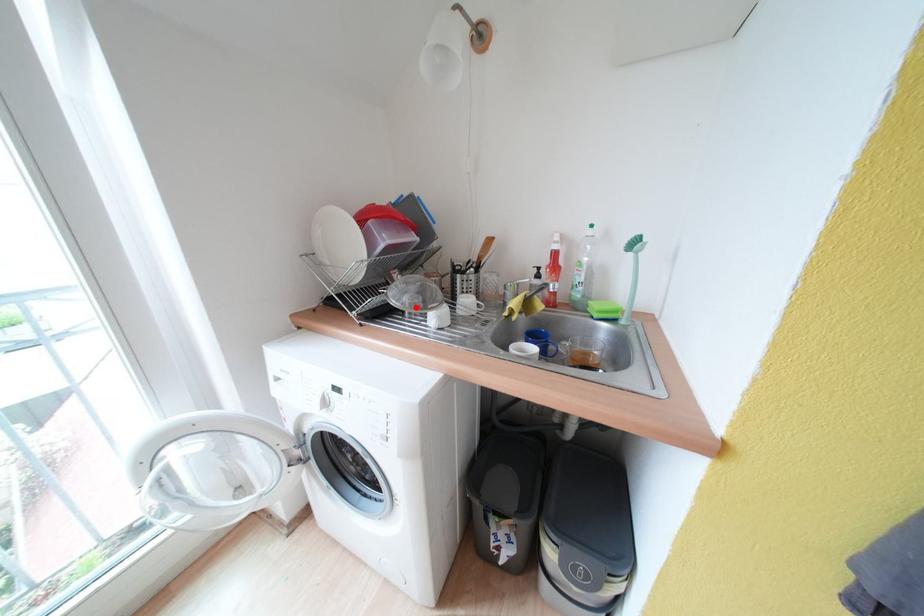
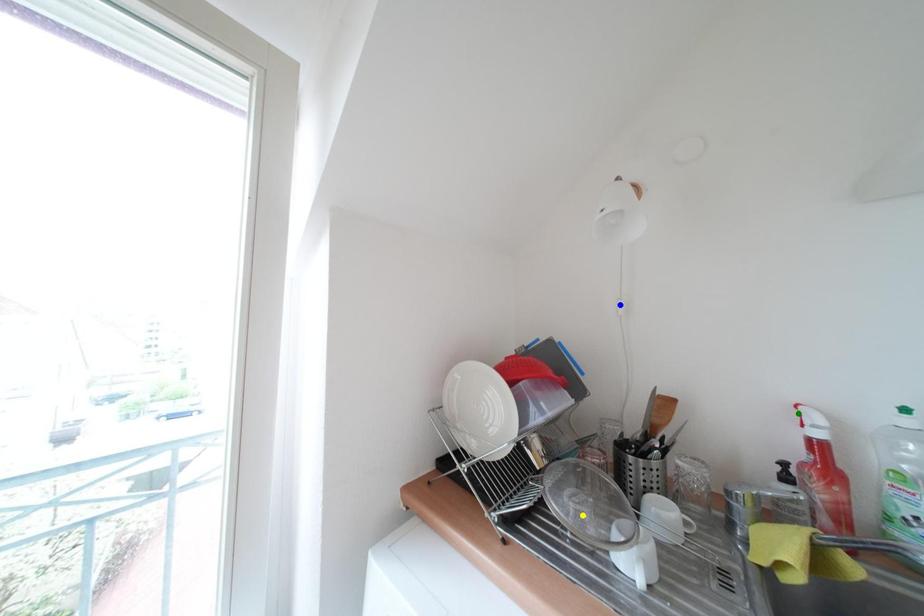
Question: I am providing you with two images of the same scene from different viewpoints. A red point is marked on the first image. You are given multiple points on the second image. In image 2, which mark is for the same physical point as the one in image 1?

Choices:
 (A) green point
 (B) blue point
 (C) yellow point

Answer: (C)